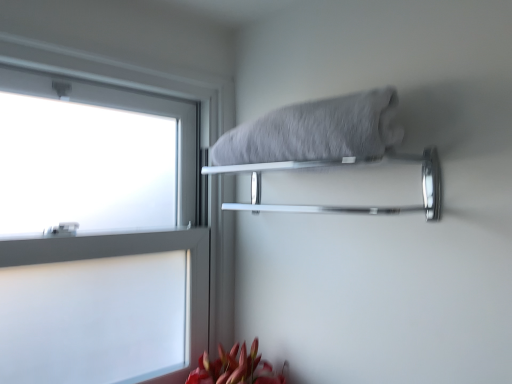
Question: Is white frosted glass at left not within chrome metallic towel bar at upper center?

Choices:
 (A) yes
 (B) no

Answer: (A)

Question: Is white frosted glass at left thinner than chrome metallic towel bar at upper center?

Choices:
 (A) no
 (B) yes

Answer: (B)

Question: Is white frosted glass at left oriented away from chrome metallic towel bar at upper center?

Choices:
 (A) yes
 (B) no

Answer: (B)

Question: Considering the relative sizes of white frosted glass at left and chrome metallic towel bar at upper center in the image provided, is white frosted glass at left wider than chrome metallic towel bar at upper center?

Choices:
 (A) no
 (B) yes

Answer: (A)

Question: Is white frosted glass at left far from chrome metallic towel bar at upper center?

Choices:
 (A) no
 (B) yes

Answer: (A)

Question: Is white frosted glass at left at the left side of chrome metallic towel bar at upper center?

Choices:
 (A) yes
 (B) no

Answer: (A)

Question: Is gray fluffy towel at upper center closer to camera compared to chrome metallic towel bar at upper center?

Choices:
 (A) yes
 (B) no

Answer: (A)

Question: Can you confirm if gray fluffy towel at upper center is thinner than chrome metallic towel bar at upper center?

Choices:
 (A) yes
 (B) no

Answer: (B)

Question: Does gray fluffy towel at upper center have a greater width compared to chrome metallic towel bar at upper center?

Choices:
 (A) yes
 (B) no

Answer: (A)

Question: Is gray fluffy towel at upper center next to chrome metallic towel bar at upper center and touching it?

Choices:
 (A) yes
 (B) no

Answer: (A)

Question: From a real-world perspective, is gray fluffy towel at upper center on chrome metallic towel bar at upper center?

Choices:
 (A) no
 (B) yes

Answer: (B)

Question: Is chrome metallic towel bar at upper center at the back of gray fluffy towel at upper center?

Choices:
 (A) no
 (B) yes

Answer: (A)

Question: Can you confirm if chrome metallic towel bar at upper center is positioned to the left of white frosted glass at left?

Choices:
 (A) yes
 (B) no

Answer: (B)